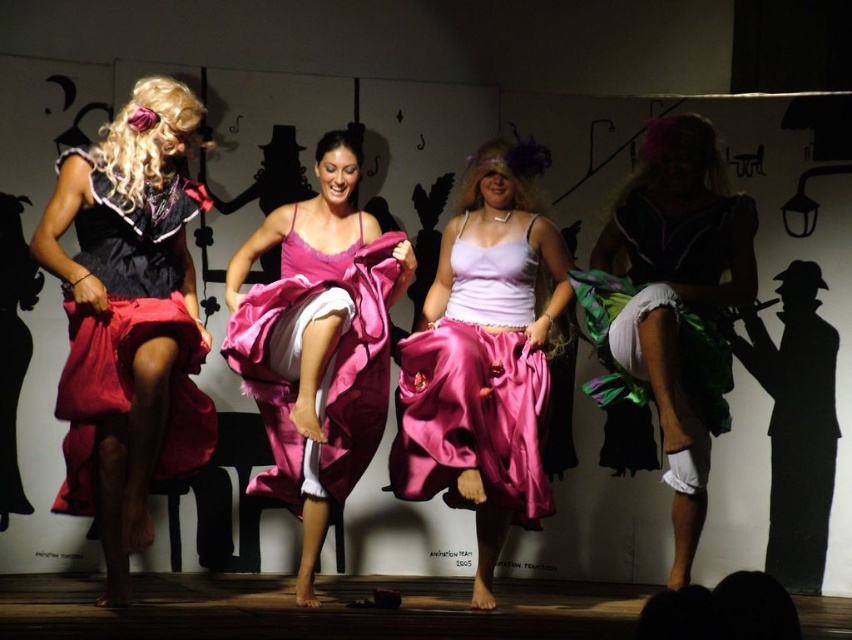
You are a photographer standing at the camera position. You want to take a photo of the matte black dress at right. The camera has a maximum focus range of 5 meters. Will you be able to capture the dress in focus?

The matte black dress at right and camera are 5.47 meters apart from each other, which exceeds the camera maximum focus range of 5 meters. Therefore, the dress will not be in focus.

Based on the photo, you are standing in the audience watching the performance. The stage has a 20 feet deep area. If you want to reach the matte black dress at right, how much distance do you have to cover?

The matte black dress at right is 17.93 feet away from the viewer, so you need to cover 17.93 feet to reach it.

You are a stage director observing the performance. You need to adjust the lighting to highlight the pink satin skirt at center and the satin pink dress at center. Since the skirt is positioned to the right of the dress, where should you direct the spotlight first to ensure both are illuminated properly?

The pink satin skirt at center is to the right of the satin pink dress at center. To illuminate both properly, direct the spotlight first to the left side where the satin pink dress at center is located, then move it to the right to include the pink satin skirt at center.